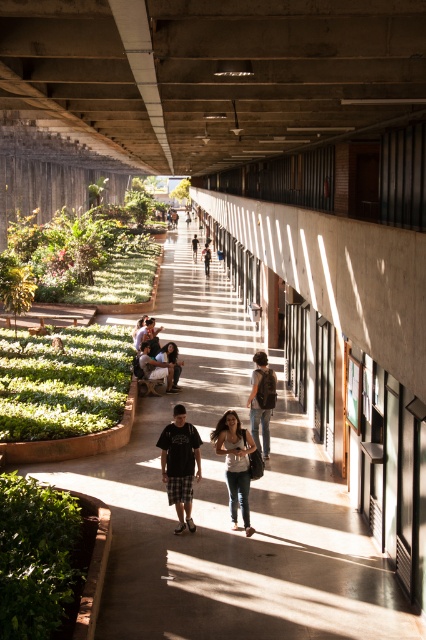
Question: Is green leafy bush at lower left to the left of brown leather backpack at right from the viewer's perspective?

Choices:
 (A) no
 (B) yes

Answer: (B)

Question: Which point appears closest to the camera in this image?

Choices:
 (A) (152, 340)
 (B) (187, 227)
 (C) (247, 435)

Answer: (C)

Question: Can you confirm if black cotton shirt at center is positioned to the left of light brown wooden chair at center?

Choices:
 (A) yes
 (B) no

Answer: (B)

Question: Which point is closer to the camera taking this photo?

Choices:
 (A) (195, 248)
 (B) (175, 355)
 (C) (187, 214)
 (D) (264, 410)

Answer: (D)

Question: Is denim jacket at center further to camera compared to light brown leather backpack at center?

Choices:
 (A) no
 (B) yes

Answer: (A)

Question: Which point is closer to the camera?

Choices:
 (A) (187, 225)
 (B) (149, 365)

Answer: (B)